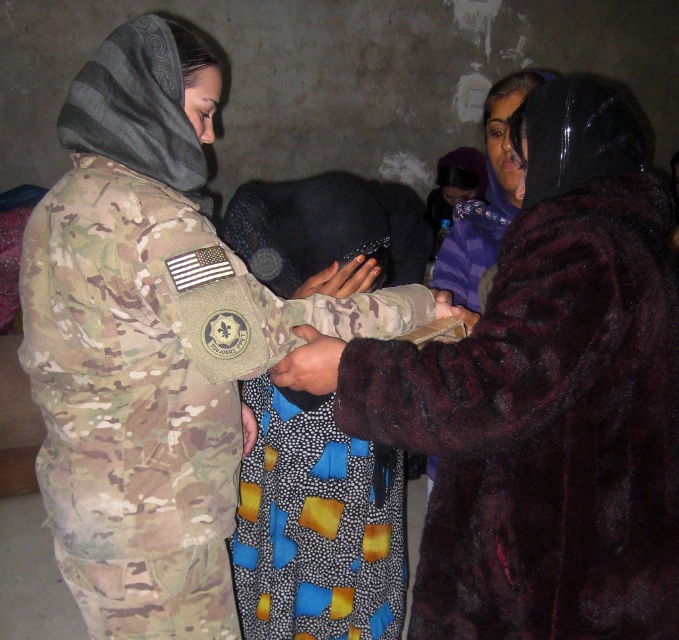
Question: Does purple striped scarf at upper center have a greater width compared to textured fabric hand at center?

Choices:
 (A) yes
 (B) no

Answer: (A)

Question: Which point appears farthest from the camera in this image?

Choices:
 (A) (528, 504)
 (B) (136, 529)
 (C) (494, 173)
 (D) (320, 333)

Answer: (C)

Question: Which of the following is the closest to the observer?

Choices:
 (A) velvet maroon coat at right
 (B) camouflage fabric hand at center

Answer: (A)

Question: Which of the following is the farthest from the observer?

Choices:
 (A) (301, 369)
 (B) (452, 316)
 (C) (323, 280)
 (D) (631, 216)

Answer: (C)

Question: Can you confirm if camouflage uniform at left is smaller than textured fabric hand at center?

Choices:
 (A) no
 (B) yes

Answer: (A)

Question: From the image, what is the correct spatial relationship of camouflage uniform at left in relation to smooth brown leather hand at center?

Choices:
 (A) below
 (B) above

Answer: (A)